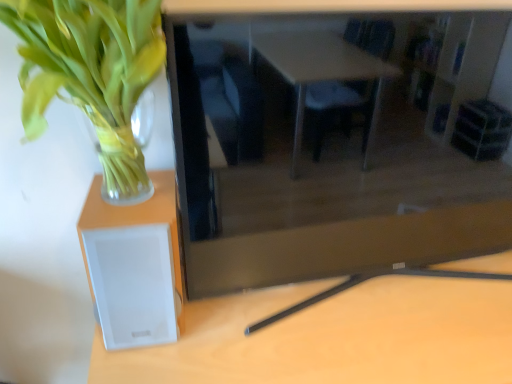
Question: Considering the relative positions of white matte speaker at left and white plastic speaker at lower left in the image provided, is white matte speaker at left to the left of white plastic speaker at lower left from the viewer's perspective?

Choices:
 (A) no
 (B) yes

Answer: (B)

Question: Can we say white matte speaker at left lies outside white plastic speaker at lower left?

Choices:
 (A) no
 (B) yes

Answer: (B)

Question: From a real-world perspective, is white matte speaker at left positioned under white plastic speaker at lower left based on gravity?

Choices:
 (A) no
 (B) yes

Answer: (A)

Question: Does white matte speaker at left turn towards white plastic speaker at lower left?

Choices:
 (A) no
 (B) yes

Answer: (A)

Question: Is white matte speaker at left positioned behind white plastic speaker at lower left?

Choices:
 (A) no
 (B) yes

Answer: (B)

Question: Considering the relative sizes of white matte speaker at left and white plastic speaker at lower left in the image provided, is white matte speaker at left wider than white plastic speaker at lower left?

Choices:
 (A) no
 (B) yes

Answer: (A)

Question: Is green leafy plant at left bigger than matte black tv at center?

Choices:
 (A) no
 (B) yes

Answer: (A)

Question: Does green leafy plant at left appear on the right side of matte black tv at center?

Choices:
 (A) yes
 (B) no

Answer: (B)

Question: Is green leafy plant at left positioned far away from matte black tv at center?

Choices:
 (A) no
 (B) yes

Answer: (A)

Question: From a real-world perspective, is green leafy plant at left under matte black tv at center?

Choices:
 (A) no
 (B) yes

Answer: (A)

Question: From the image's perspective, is green leafy plant at left on matte black tv at center?

Choices:
 (A) no
 (B) yes

Answer: (B)

Question: Is matte black tv at center completely or partially inside green leafy plant at left?

Choices:
 (A) yes
 (B) no

Answer: (B)

Question: Is green leafy plant at left wider than white matte speaker at left?

Choices:
 (A) no
 (B) yes

Answer: (B)